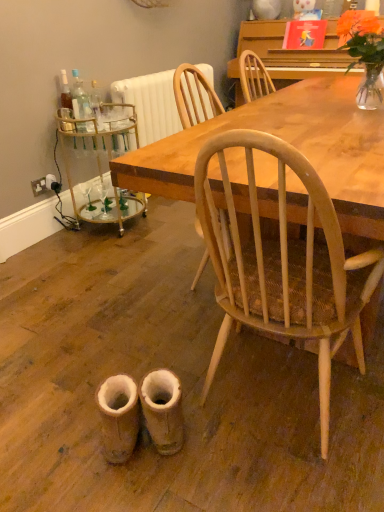
Question: From a real-world perspective, is leather boot at lower center, which is counted as the 1th walking shoe, starting from the right, physically above orange matte flower at upper right?

Choices:
 (A) no
 (B) yes

Answer: (A)

Question: Considering the relative positions of leather boot at lower center, which is counted as the second walking shoe, starting from the left, and orange matte flower at upper right in the image provided, is leather boot at lower center, which is counted as the second walking shoe, starting from the left, to the left of orange matte flower at upper right from the viewer's perspective?

Choices:
 (A) yes
 (B) no

Answer: (A)

Question: Can we say leather boot at lower center, which is counted as the second walking shoe, starting from the left, lies outside orange matte flower at upper right?

Choices:
 (A) no
 (B) yes

Answer: (B)

Question: Can you confirm if leather boot at lower center, which is counted as the second walking shoe, starting from the left, is smaller than orange matte flower at upper right?

Choices:
 (A) no
 (B) yes

Answer: (B)

Question: Considering the relative positions of leather boot at lower center, which is counted as the 1th walking shoe, starting from the right, and orange matte flower at upper right in the image provided, is leather boot at lower center, which is counted as the 1th walking shoe, starting from the right, behind orange matte flower at upper right?

Choices:
 (A) yes
 (B) no

Answer: (B)

Question: Considering their positions, is orange matte vase at upper right located in front of or behind leather boot at lower center, which is counted as the second walking shoe, starting from the left?

Choices:
 (A) behind
 (B) front

Answer: (A)

Question: Is point (354, 22) closer or farther from the camera than point (160, 439)?

Choices:
 (A) farther
 (B) closer

Answer: (A)

Question: From a real-world perspective, is orange matte vase at upper right positioned above or below leather boot at lower center, which is counted as the 1th walking shoe, starting from the right?

Choices:
 (A) above
 (B) below

Answer: (A)

Question: Is orange matte vase at upper right situated inside leather boot at lower center, which is counted as the 1th walking shoe, starting from the right, or outside?

Choices:
 (A) inside
 (B) outside

Answer: (B)

Question: Considering their positions, is orange matte flower at upper right located in front of or behind gold mirrored bar cart at left?

Choices:
 (A) behind
 (B) front

Answer: (A)

Question: Visually, is orange matte flower at upper right positioned to the left or to the right of gold mirrored bar cart at left?

Choices:
 (A) right
 (B) left

Answer: (A)

Question: Is orange matte flower at upper right bigger or smaller than gold mirrored bar cart at left?

Choices:
 (A) big
 (B) small

Answer: (B)

Question: Does point (340, 44) appear closer or farther from the camera than point (72, 164)?

Choices:
 (A) farther
 (B) closer

Answer: (A)

Question: From the image's perspective, relative to orange matte vase at upper right, is wooden table at center above or below?

Choices:
 (A) above
 (B) below

Answer: (B)

Question: From a real-world perspective, is wooden table at center above or below orange matte vase at upper right?

Choices:
 (A) below
 (B) above

Answer: (A)